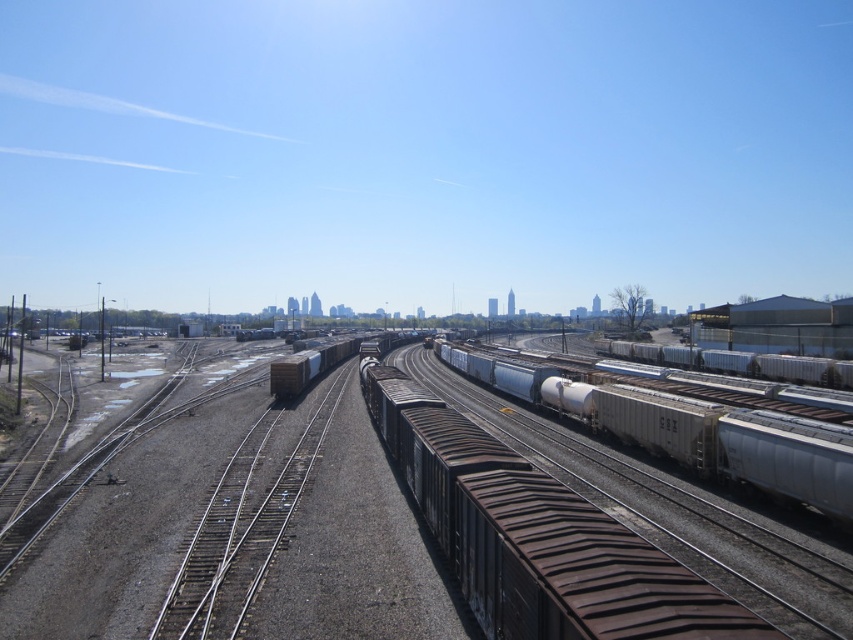
Which is more to the left, rusty metal track at center or metallic silver tank car at center?

From the viewer's perspective, rusty metal track at center appears more on the left side.

Is point (196, 486) behind point (730, 416)?

Yes.

The image size is (853, 640). In order to click on rusty metal track at center in this screenshot , I will do `click(231, 522)`.

The image size is (853, 640). Describe the element at coordinates (735, 444) in the screenshot. I see `metallic silver tank car at center` at that location.

Is point (665, 454) more distant than point (291, 356)?

No, it is not.

This screenshot has width=853, height=640. Find the location of `metallic silver tank car at center`. metallic silver tank car at center is located at coordinates (735, 444).

Is point (787, 561) positioned in front of point (337, 355)?

That is True.

Is rusty metal track at center positioned before brown matte container at center?

Yes, it is in front of brown matte container at center.

At what (x,y) coordinates should I click in order to perform the action: click on rusty metal track at center. Please return your answer as a coordinate pair (x, y). Looking at the image, I should click on (231, 522).